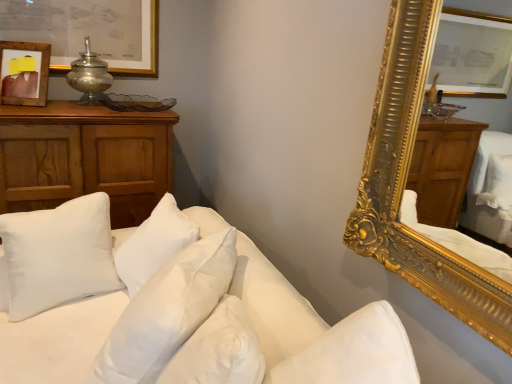
Question: Considering the relative positions of white soft pillow at center, the second pillow in the left-to-right sequence, and white soft pillows at lower left in the image provided, is white soft pillow at center, the second pillow in the left-to-right sequence, to the left of white soft pillows at lower left from the viewer's perspective?

Choices:
 (A) yes
 (B) no

Answer: (B)

Question: From a real-world perspective, is white soft pillow at center, which is the first pillow from right to left, positioned over white soft pillows at lower left based on gravity?

Choices:
 (A) yes
 (B) no

Answer: (A)

Question: Considering the relative sizes of white soft pillow at center, the second pillow in the left-to-right sequence, and white soft pillows at lower left in the image provided, is white soft pillow at center, the second pillow in the left-to-right sequence, bigger than white soft pillows at lower left?

Choices:
 (A) no
 (B) yes

Answer: (A)

Question: Can you see white soft pillow at center, the second pillow in the left-to-right sequence, touching white soft pillows at lower left?

Choices:
 (A) yes
 (B) no

Answer: (B)

Question: Is white soft pillow at center, the second pillow in the left-to-right sequence, at the right side of white soft pillows at lower left?

Choices:
 (A) no
 (B) yes

Answer: (B)

Question: Is white soft pillow at center, positioned as the 2th pillow in back-to-front order, thinner than white soft pillows at lower left?

Choices:
 (A) no
 (B) yes

Answer: (B)

Question: From the image's perspective, is metallic silver table lamp at upper left beneath wooden cabinet at left?

Choices:
 (A) yes
 (B) no

Answer: (B)

Question: Is metallic silver table lamp at upper left further to the viewer compared to wooden cabinet at left?

Choices:
 (A) yes
 (B) no

Answer: (A)

Question: Can you confirm if metallic silver table lamp at upper left is taller than wooden cabinet at left?

Choices:
 (A) yes
 (B) no

Answer: (B)

Question: Is metallic silver table lamp at upper left wider than wooden cabinet at left?

Choices:
 (A) yes
 (B) no

Answer: (B)

Question: Is metallic silver table lamp at upper left next to wooden cabinet at left?

Choices:
 (A) yes
 (B) no

Answer: (B)

Question: Does metallic silver table lamp at upper left have a lesser width compared to wooden cabinet at left?

Choices:
 (A) yes
 (B) no

Answer: (A)

Question: Considering the relative sizes of wooden cabinet at left and white soft pillow at center, positioned as the 2th pillow in back-to-front order, in the image provided, is wooden cabinet at left shorter than white soft pillow at center, positioned as the 2th pillow in back-to-front order,?

Choices:
 (A) no
 (B) yes

Answer: (A)